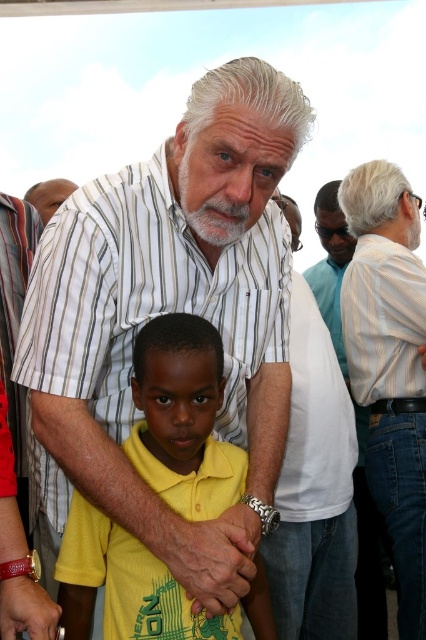
Does white striped shirt at center have a lesser width compared to yellow matte shirt at center?

In fact, white striped shirt at center might be wider than yellow matte shirt at center.

Between white striped shirt at center and yellow matte shirt at center, which one is positioned lower?

yellow matte shirt at center is lower down.

Where is `white striped shirt at center`? white striped shirt at center is located at coordinates (167, 310).

Between point (420, 472) and point (321, 280), which one is positioned behind?

The point (321, 280) is more distant.

The image size is (426, 640). What are the coordinates of `white striped shirt at upper right` in the screenshot? It's located at (389, 364).

At what (x,y) coordinates should I click in order to perform the action: click on white striped shirt at upper right. Please return your answer as a coordinate pair (x, y). The image size is (426, 640). Looking at the image, I should click on (389, 364).

Who is more distant from viewer, (339, 237) or (55, 188)?

Point (339, 237)

Who is more forward, (348, 260) or (62, 182)?

Point (62, 182) is in front.

Find the location of a particular element. light blue striped shirt at upper right is located at coordinates (331, 264).